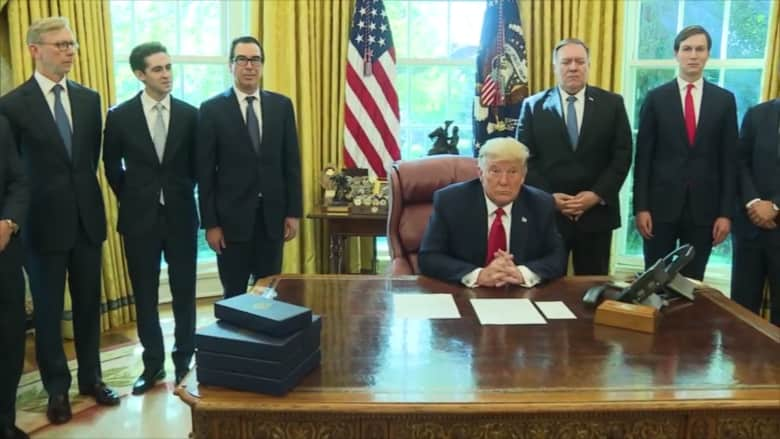
Locate an element on the screen. This screenshot has height=439, width=780. window is located at coordinates (199, 42), (429, 34), (714, 13).